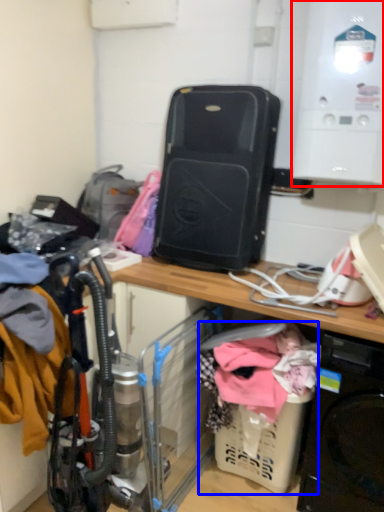
Question: Which object is closer to the camera taking this photo, appliance (highlighted by a red box) or baby carriage (highlighted by a blue box)?

Choices:
 (A) appliance
 (B) baby carriage

Answer: (A)